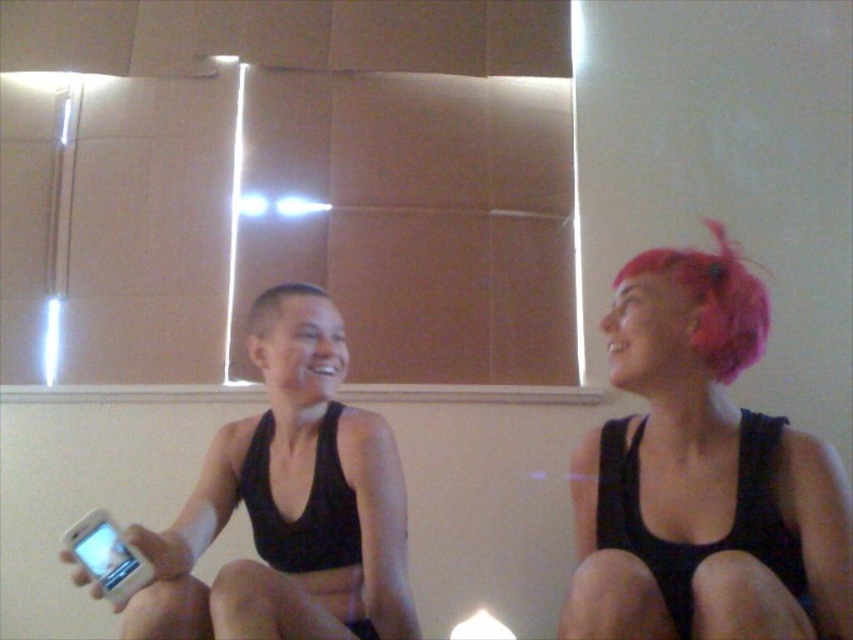
Question: Among these points, which one is farthest from the camera?

Choices:
 (A) (712, 349)
 (B) (142, 611)
 (C) (299, 292)

Answer: (C)

Question: Does pink matte hair at upper right lie behind pink fluffy hair at upper right?

Choices:
 (A) no
 (B) yes

Answer: (A)

Question: Among these objects, which one is nearest to the camera?

Choices:
 (A) pink fluffy hair at upper right
 (B) black matte tank top at center
 (C) short hair at center

Answer: (B)

Question: Is pink matte hair at upper right to the left of short hair at center from the viewer's perspective?

Choices:
 (A) yes
 (B) no

Answer: (B)

Question: Which point appears farthest from the camera in this image?

Choices:
 (A) (666, 275)
 (B) (328, 332)
 (C) (285, 282)
 (D) (598, 432)

Answer: (C)

Question: Is pink matte hair at upper right below pink fluffy hair at upper right?

Choices:
 (A) no
 (B) yes

Answer: (B)